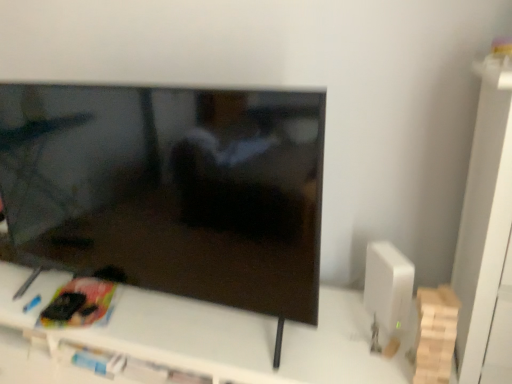
Describe the element at coordinates (170, 189) in the screenshot. This screenshot has width=512, height=384. I see `matte black tv at center` at that location.

In order to face white plastic tv stand at center, should I rotate leftwards or rightwards?

Turn left approximately 11.970 degrees to face it.

The width and height of the screenshot is (512, 384). What do you see at coordinates (247, 340) in the screenshot?
I see `white plastic tv stand at center` at bounding box center [247, 340].

Describe the element at coordinates (486, 227) in the screenshot. Image resolution: width=512 pixels, height=384 pixels. I see `white matte cabinet at right` at that location.

This screenshot has width=512, height=384. In order to click on matte black tv at center in this screenshot , I will do `click(170, 189)`.

Could you tell me if matte black tv at center is facing white plastic tv stand at center?

No, matte black tv at center is not turned towards white plastic tv stand at center.

Who is bigger, matte black tv at center or white plastic tv stand at center?

Bigger between the two is white plastic tv stand at center.

Which of these two, matte black tv at center or white plastic tv stand at center, is wider?

Wider between the two is white plastic tv stand at center.

Where is `television that appears above the white matte cabinet at right (from a real-world perspective)`? Image resolution: width=512 pixels, height=384 pixels. television that appears above the white matte cabinet at right (from a real-world perspective) is located at coordinates (170, 189).

From a real-world perspective, is matte black tv at center positioned under white matte cabinet at right based on gravity?

Actually, matte black tv at center is physically above white matte cabinet at right in the real world.

From the image's perspective, who appears lower, matte black tv at center or white matte cabinet at right?

From the image's view, white matte cabinet at right is below.

Considering the positions of objects white matte cabinet at right and matte black tv at center in the image provided, who is in front, white matte cabinet at right or matte black tv at center?

Positioned in front is white matte cabinet at right.

Would you say white matte cabinet at right is outside matte black tv at center?

Indeed, white matte cabinet at right is completely outside matte black tv at center.

Looking at their sizes, would you say white matte cabinet at right is wider or thinner than matte black tv at center?

white matte cabinet at right is wider than matte black tv at center.

Consider the image. Is white matte cabinet at right to the left of matte black tv at center from the viewer's perspective?

Incorrect, white matte cabinet at right is not on the left side of matte black tv at center.

Based on the photo, considering their positions, is white matte cabinet at right located in front of or behind white plastic tv stand at center?

Clearly, white matte cabinet at right is in front of white plastic tv stand at center.

Which of these two, white matte cabinet at right or white plastic tv stand at center, is wider?

Wider between the two is white plastic tv stand at center.

From the image's perspective, which one is positioned lower, white matte cabinet at right or white plastic tv stand at center?

white plastic tv stand at center.

Which is more to the right, white plastic tv stand at center or matte black tv at center?

From the viewer's perspective, white plastic tv stand at center appears more on the right side.

Between white plastic tv stand at center and matte black tv at center, which one has larger size?

white plastic tv stand at center.

What's the angular difference between white plastic tv stand at center and matte black tv at center's facing directions?

They differ by 0.000424 degrees in their facing directions.

Is white plastic tv stand at center positioned behind matte black tv at center?

Yes, it is behind matte black tv at center.

Is white plastic tv stand at center turned away from white matte cabinet at right?

No, white matte cabinet at right is not at the back of white plastic tv stand at center.

Between white plastic tv stand at center and white matte cabinet at right, which one appears on the right side from the viewer's perspective?

From the viewer's perspective, white matte cabinet at right appears more on the right side.

In the image, there is a white plastic tv stand at center. Where is `tv cabinet above it (from the image's perspective)`? This screenshot has height=384, width=512. tv cabinet above it (from the image's perspective) is located at coordinates (486, 227).

Considering the relative sizes of white plastic tv stand at center and white matte cabinet at right in the image provided, is white plastic tv stand at center thinner than white matte cabinet at right?

Incorrect, the width of white plastic tv stand at center is not less than that of white matte cabinet at right.

The width and height of the screenshot is (512, 384). In order to click on television located above the white plastic tv stand at center (from the image's perspective) in this screenshot , I will do `click(170, 189)`.

I want to click on tv cabinet lying in front of the matte black tv at center, so click(x=486, y=227).

Looking at the image, which one is located further to white plastic tv stand at center, white matte cabinet at right or matte black tv at center?

The object further to white plastic tv stand at center is white matte cabinet at right.

Estimate the real-world distances between objects in this image. Which object is further from matte black tv at center, white plastic tv stand at center or white matte cabinet at right?

Based on the image, white matte cabinet at right appears to be further to matte black tv at center.

Based on their spatial positions, is matte black tv at center or white plastic tv stand at center further from white matte cabinet at right?

Among the two, matte black tv at center is located further to white matte cabinet at right.

From the image, which object appears to be nearer to white plastic tv stand at center, matte black tv at center or white matte cabinet at right?

matte black tv at center lies closer to white plastic tv stand at center than the other object.

Considering their positions, is white matte cabinet at right positioned further to matte black tv at center than white plastic tv stand at center?

white matte cabinet at right lies further to matte black tv at center than the other object.

Based on their spatial positions, is white plastic tv stand at center or matte black tv at center closer to white matte cabinet at right?

Based on the image, white plastic tv stand at center appears to be nearer to white matte cabinet at right.

What are the coordinates of `furniture between matte black tv at center and white matte cabinet at right from left to right` in the screenshot? It's located at tap(247, 340).